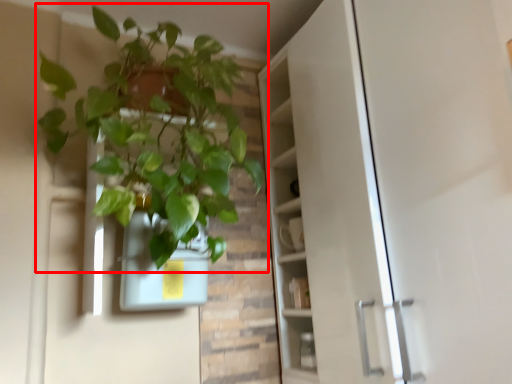
Question: From the image's perspective, what is the correct spatial relationship of houseplant (annotated by the red box) in relation to flowerpot?

Choices:
 (A) above
 (B) below

Answer: (A)